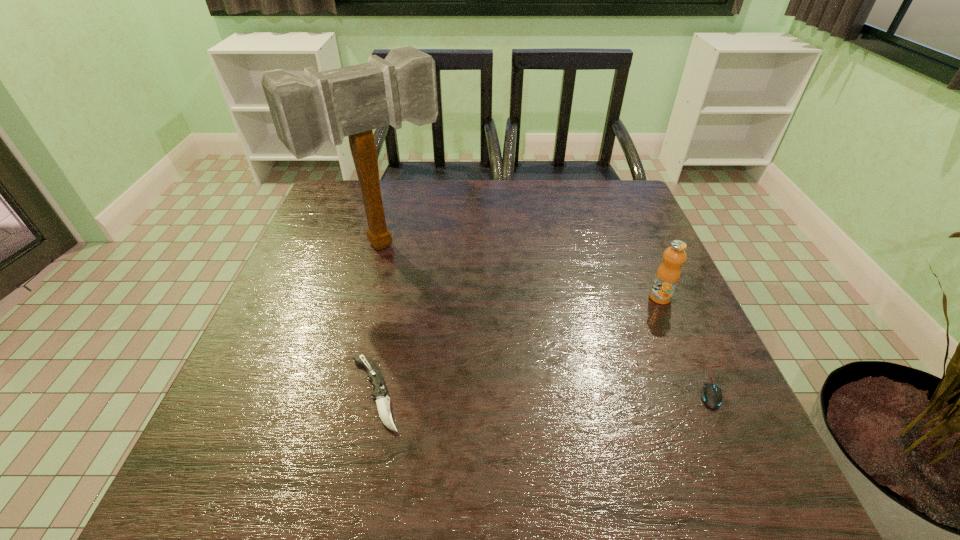
Where is `free spot between the pocketknife and the third shortest object`? free spot between the pocketknife and the third shortest object is located at coordinates (517, 346).

Find the location of a particular element. The image size is (960, 540). empty space that is in between the third nearest object and the pocketknife is located at coordinates (517, 346).

Where is `empty space between the mallet and the mouse`? empty space between the mallet and the mouse is located at coordinates (548, 314).

This screenshot has width=960, height=540. Identify the location of unoccupied area between the tallest object and the mouse. (548, 314).

The width and height of the screenshot is (960, 540). Find the location of `empty space between the mouse and the orange juice`. empty space between the mouse and the orange juice is located at coordinates (686, 340).

You are a GUI agent. You are given a task and a screenshot of the screen. Output one action in this format:
    pyautogui.click(x=<x>, y=<y>)
    Task: Click on the empty space between the third shortest object and the mouse
    
    Given the screenshot: What is the action you would take?
    pyautogui.click(x=686, y=340)

Where is `vacant area that lies between the mouse and the farthest object`? The image size is (960, 540). vacant area that lies between the mouse and the farthest object is located at coordinates (548, 314).

Identify the location of free space between the third nearest object and the tallest object. Image resolution: width=960 pixels, height=540 pixels. (521, 271).

Identify the location of object that is the second closest one to the orange juice. (x=308, y=110).

Locate which object is the third closest to the tallest object. Please provide its 2D coordinates. Your answer should be formatted as a tuple, i.e. [(x, y)], where the tuple contains the x and y coordinates of a point satisfying the conditions above.

[(712, 397)]